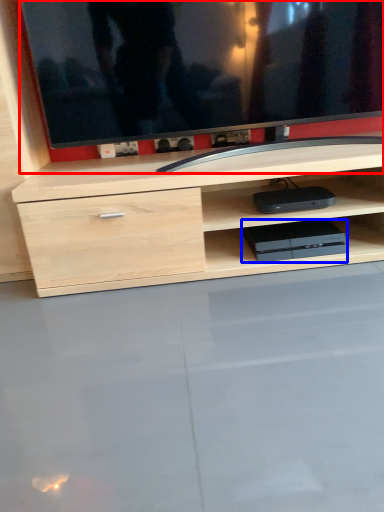
Question: Which object appears farthest to the camera in this image, television (highlighted by a red box) or equipment (highlighted by a blue box)?

Choices:
 (A) television
 (B) equipment

Answer: (B)